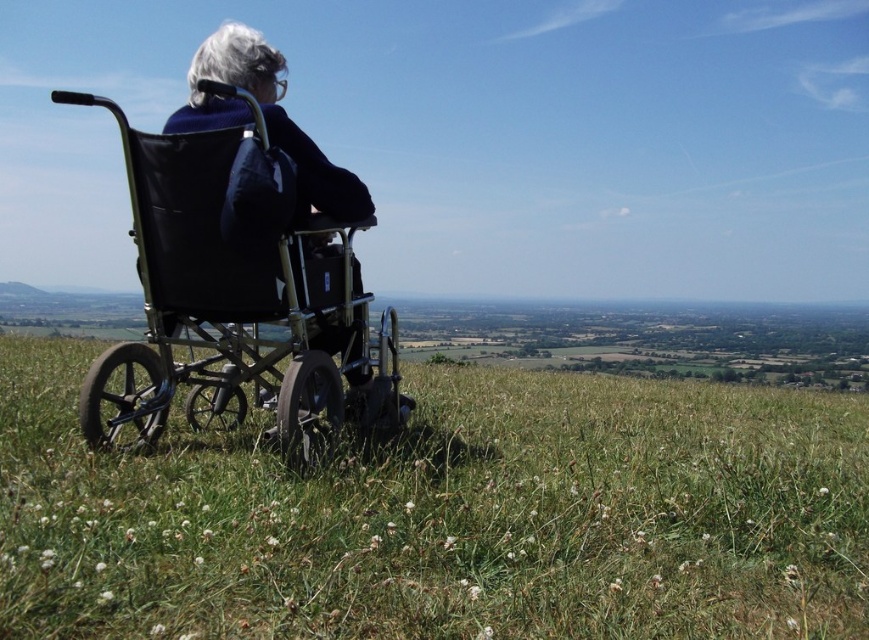
Between metallic black wheelchair at left and black fabric wheelchair at center, which one has less height?

metallic black wheelchair at left is shorter.

Find the location of a particular element. The height and width of the screenshot is (640, 869). metallic black wheelchair at left is located at coordinates (233, 307).

Locate an element on the screen. This screenshot has height=640, width=869. metallic black wheelchair at left is located at coordinates (233, 307).

Does green grassy field at center lie behind black fabric wheelchair at center?

No, it is not.

Which is in front, point (526, 557) or point (226, 124)?

Point (526, 557) is in front.

Locate an element on the screen. green grassy field at center is located at coordinates (443, 515).

This screenshot has height=640, width=869. What do you see at coordinates (443, 515) in the screenshot? I see `green grassy field at center` at bounding box center [443, 515].

Consider the image. Is green grassy field at center shorter than metallic black wheelchair at left?

Yes, green grassy field at center is shorter than metallic black wheelchair at left.

This screenshot has height=640, width=869. Identify the location of green grassy field at center. (443, 515).

Identify the location of green grassy field at center. This screenshot has width=869, height=640. (443, 515).